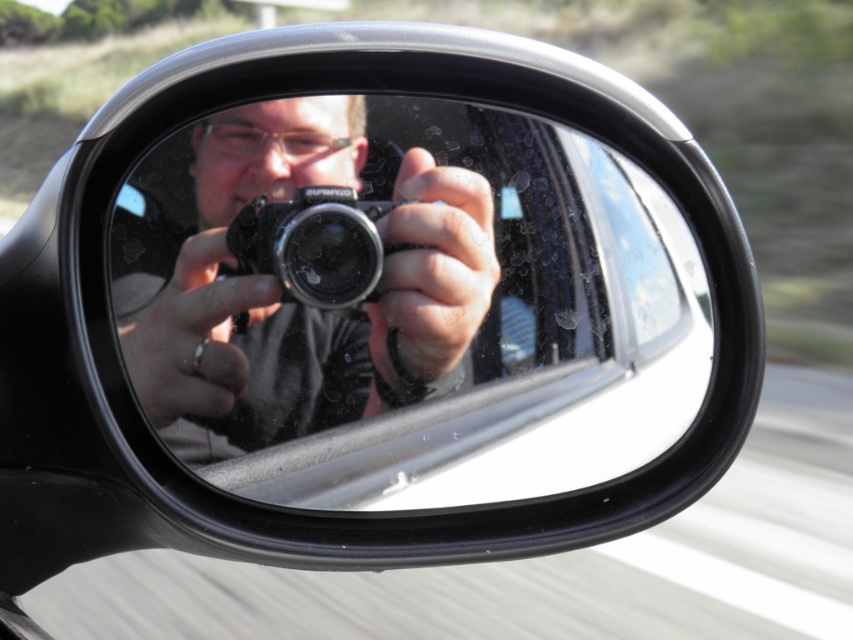
You are looking at the car mirror reflection and see two points marked in the image. Which point is closer to you, point (138, 316) or point (305, 291)?

Point (138, 316) is closer to the viewer than point (305, 291).

You are a photographer trying to take a self portrait using the car side mirror. You have two cameras, the matte black camera at center and the black plastic camera at center. Which camera will appear larger in the reflection?

The matte black camera at center will appear larger in the reflection because it is positioned in front of the black plastic camera at center, making it closer to the mirror and thus appear bigger.